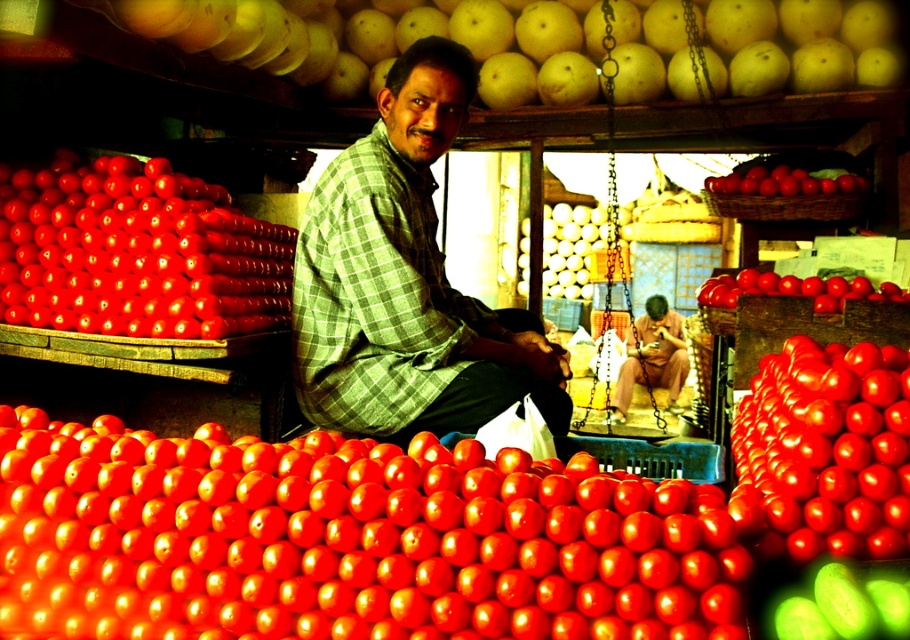
Does green checkered shirt at center lie behind smooth yellow pomelo at upper center?

That is False.

Can you confirm if green checkered shirt at center is positioned to the left of smooth yellow pomelo at upper center?

Yes, green checkered shirt at center is to the left of smooth yellow pomelo at upper center.

Between point (567, 428) and point (845, 13), which one is positioned in front?

Positioned in front is point (567, 428).

Identify the location of green checkered shirt at center. The image size is (910, 640). (403, 282).

Is glossy red tomato at center below smooth yellow pomelo at upper center?

Yes, glossy red tomato at center is below smooth yellow pomelo at upper center.

Consider the image. Does glossy red tomato at center lie in front of smooth yellow pomelo at upper center?

Yes, it is in front of smooth yellow pomelo at upper center.

Image resolution: width=910 pixels, height=640 pixels. What are the coordinates of `glossy red tomato at center` in the screenshot? It's located at (347, 540).

Locate an element on the screen. glossy red tomato at center is located at coordinates [x=347, y=540].

Does smooth yellow pomelo at upper center appear under glossy red tomato at upper right?

Actually, smooth yellow pomelo at upper center is above glossy red tomato at upper right.

Between point (349, 84) and point (729, 186), which one is positioned in front?

Positioned in front is point (729, 186).

The image size is (910, 640). I want to click on smooth yellow pomelo at upper center, so click(393, 38).